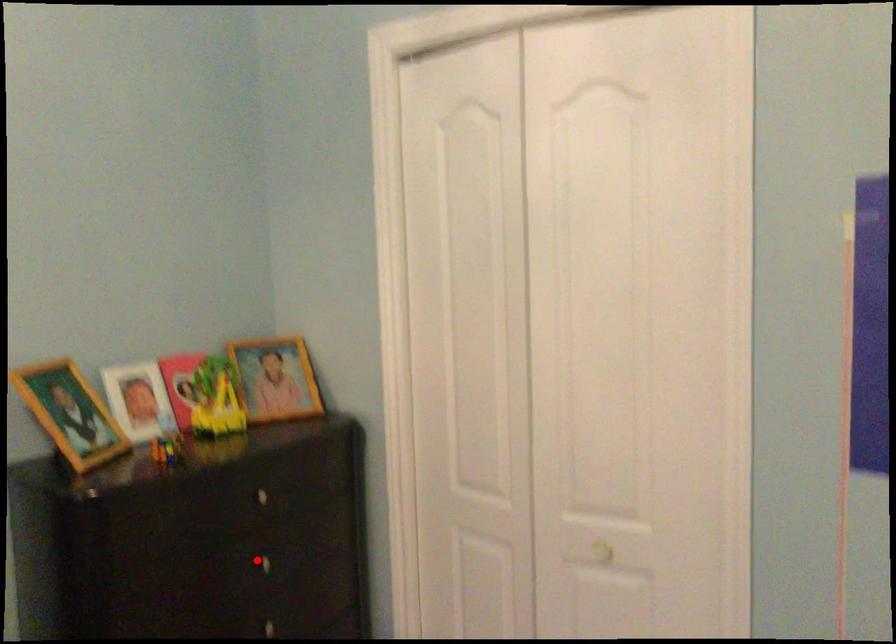
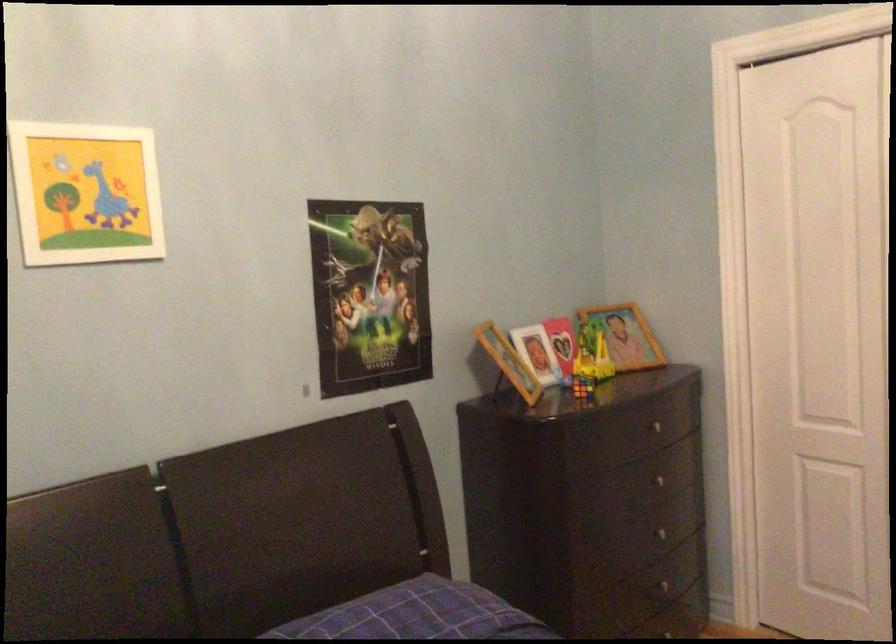
Question: I am providing you with two images of the same scene from different viewpoints. Given a red point in image1, look at the same physical point in image2. Is it:

Choices:
 (A) Closer to the viewpoint
 (B) Farther from the viewpoint

Answer: (B)